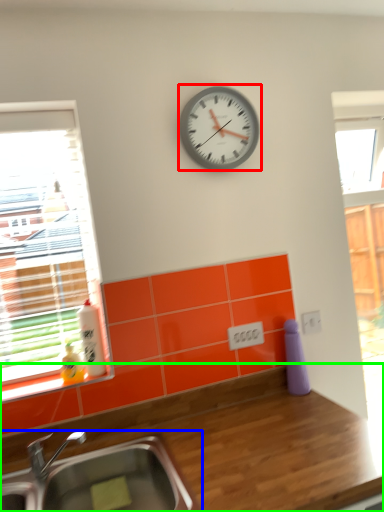
Question: Based on their relative distances, which object is farther from wall clock (highlighted by a red box)? Choose from sink (highlighted by a blue box) and countertop (highlighted by a green box).

Choices:
 (A) sink
 (B) countertop

Answer: (A)